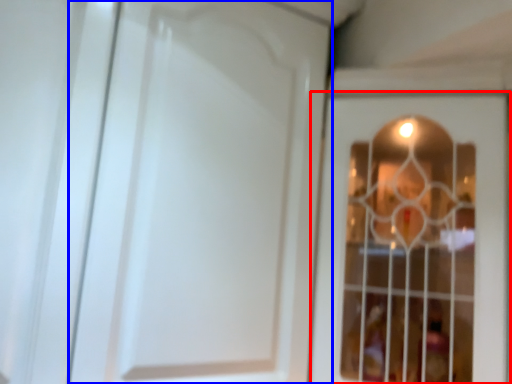
Question: Which object is further to the camera taking this photo, door (highlighted by a red box) or door (highlighted by a blue box)?

Choices:
 (A) door
 (B) door

Answer: (B)